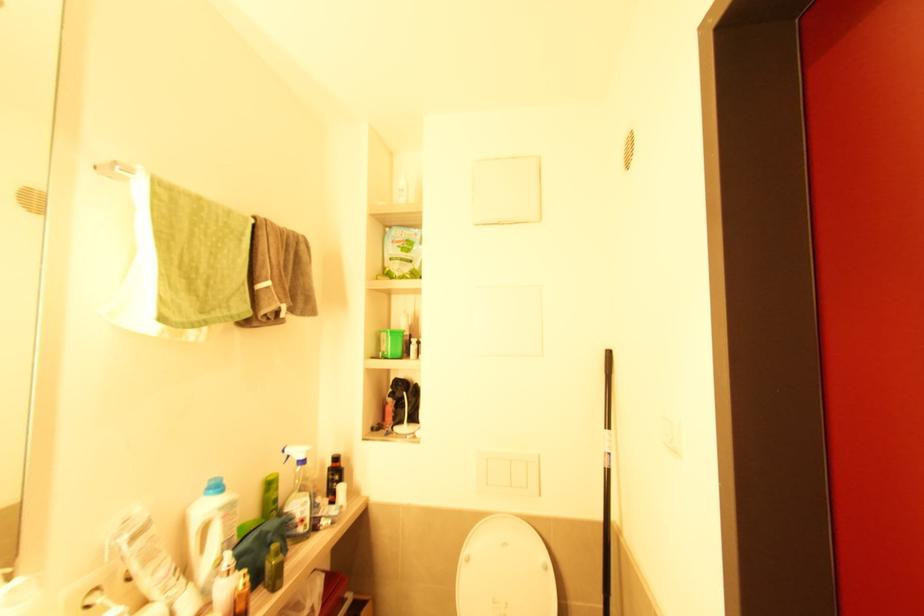
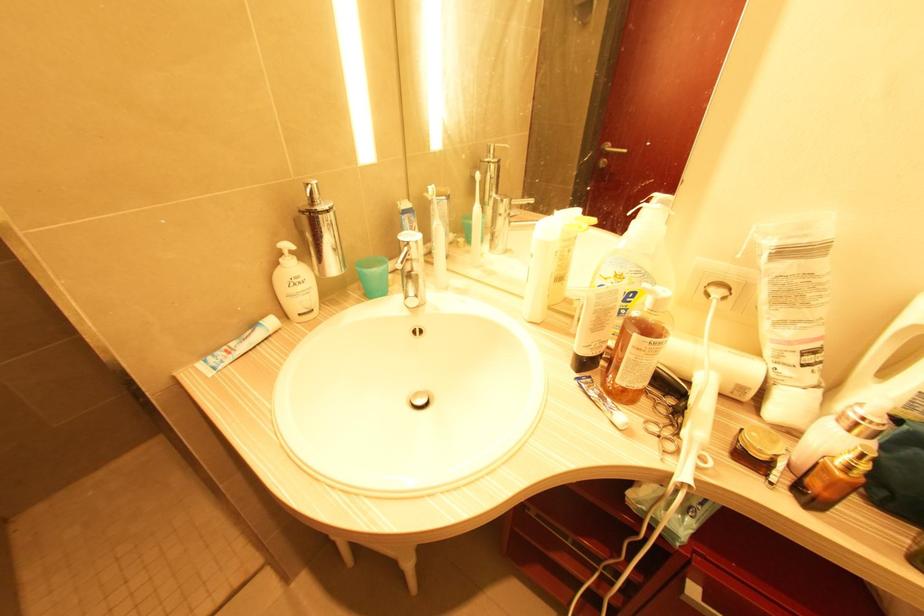
The point at (247, 585) is marked in the first image. Where is the corresponding point in the second image?

(850, 468)